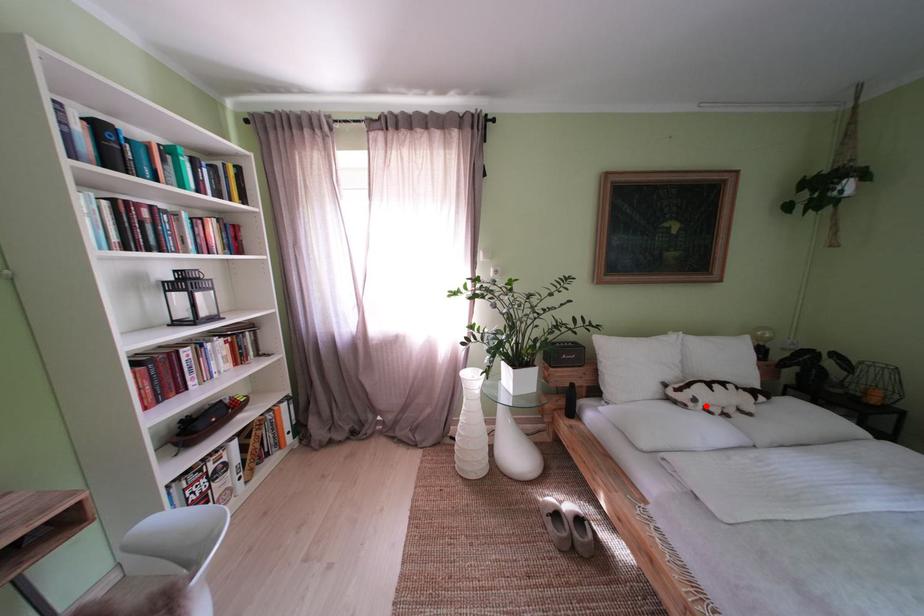
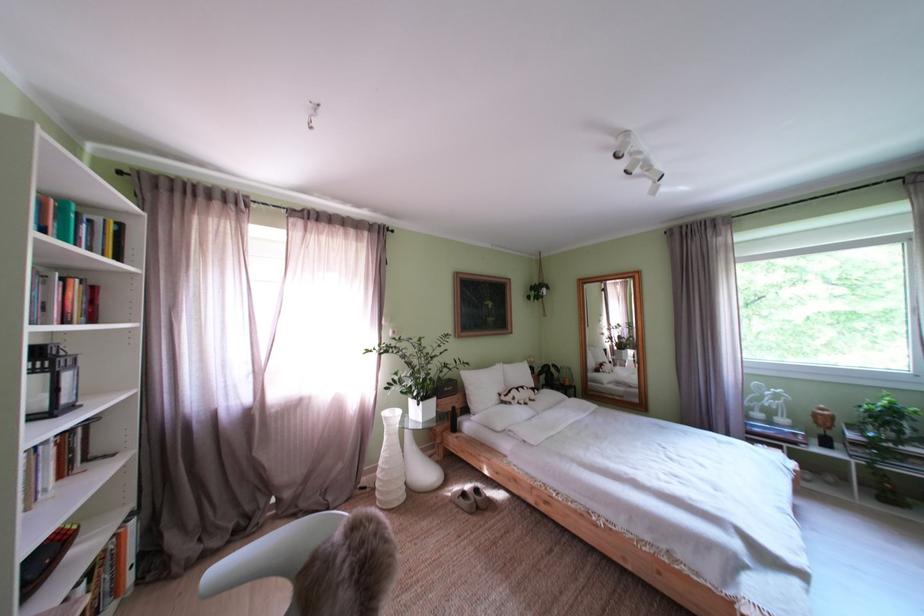
Where in the second image is the point corresponding to the highlighted location from the first image?

(525, 405)